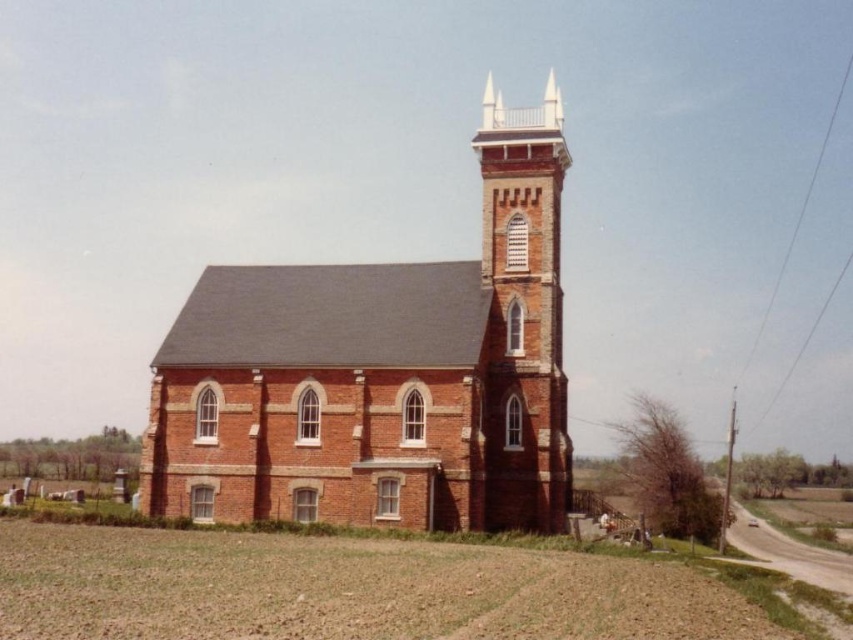
You are standing in front of the church and want to determine the relative positions of two points marked on the image. Which point is nearer to you, point (440, 522) or point (556, 97)?

Point (440, 522) is closer to the viewer than point (556, 97).